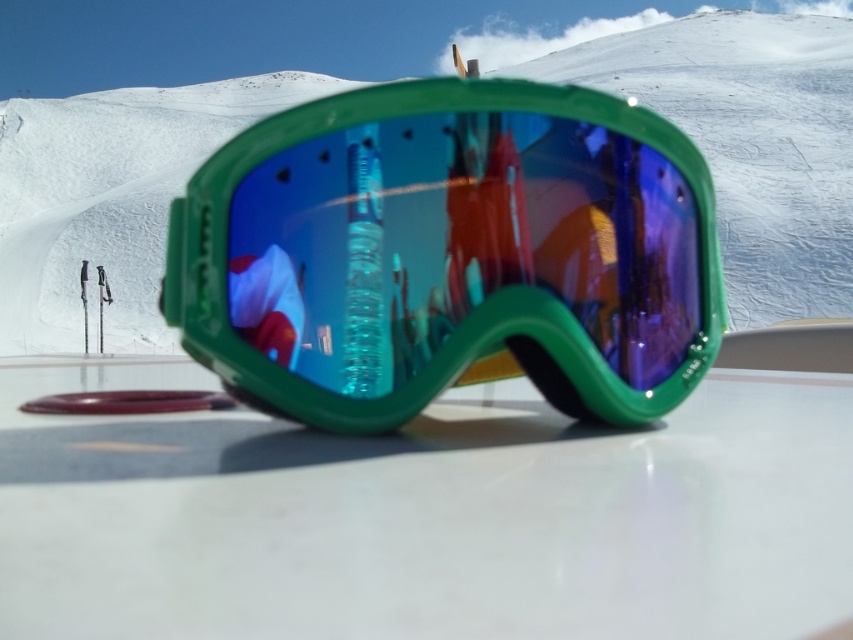
You are a photographer setting up equipment in the scene. You need to place a tripod between the white glossy table at center and the green plastic goggles at center. Which object should the tripod be placed closer to, based on their positions?

The white glossy table at center is located below the green plastic goggles at center, so the tripod should be placed closer to the white glossy table at center to position it between them.

You are a photographer trying to capture the reflection of the person in the ski goggles. The two points marked as point (253, 602) are the corners of the ski goggles. How far apart are these two points?

The two points marked as point (253, 602) are 6.58 inches apart.

You are setting up a display for winter sports equipment. You have a white glossy table at center and a white matte snow at center. Which surface will show reflections more clearly?

The white glossy table at center will show reflections more clearly because glossy surfaces typically reflect light better than matte surfaces.